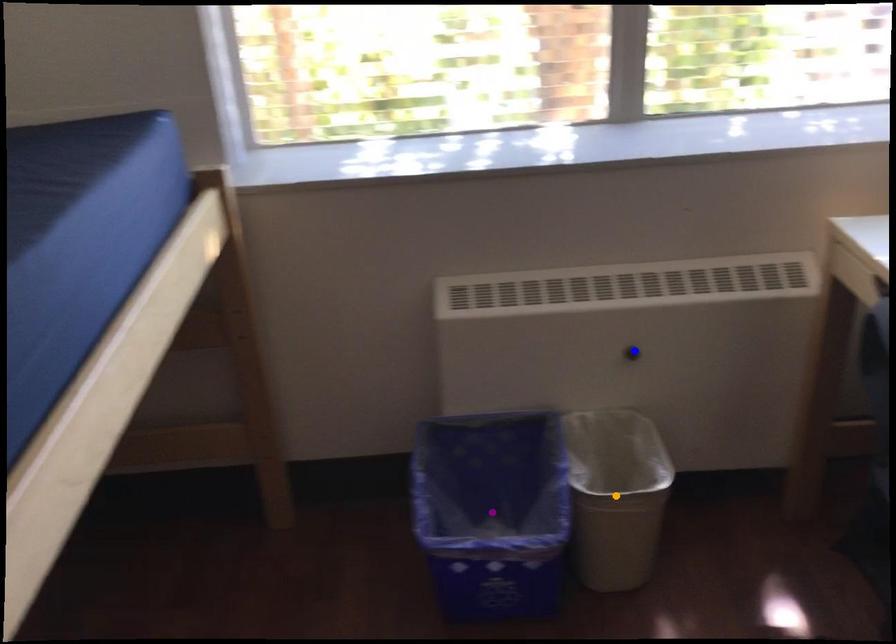
Order these from nearest to farthest:
blue point
purple point
orange point

1. blue point
2. purple point
3. orange point